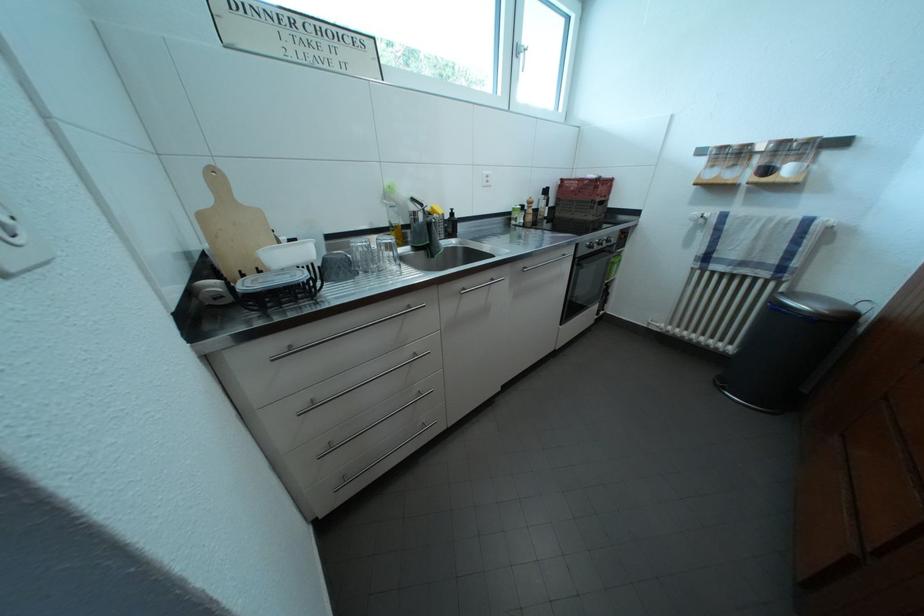
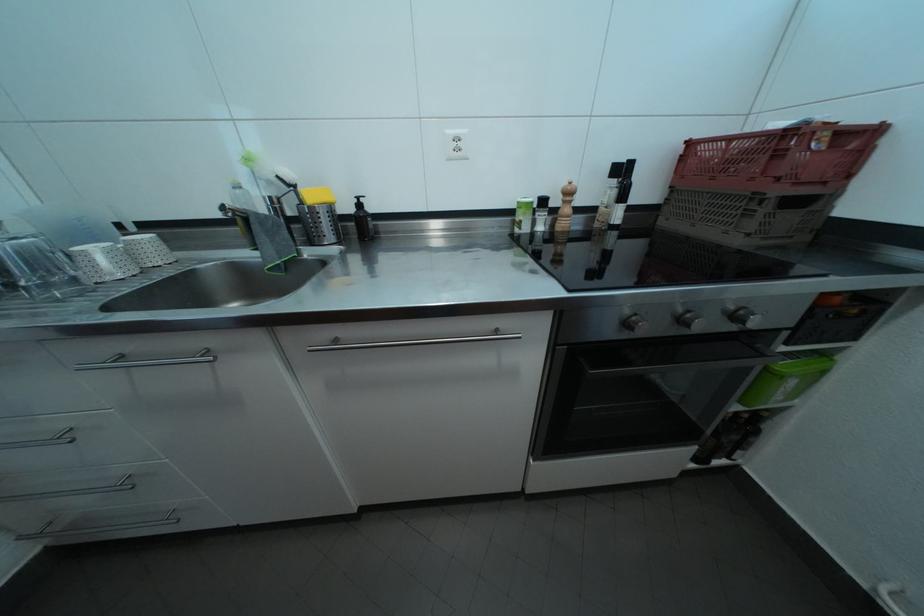
Locate, in the second image, the point that corresponds to pixel 535 214 in the first image.

(564, 208)